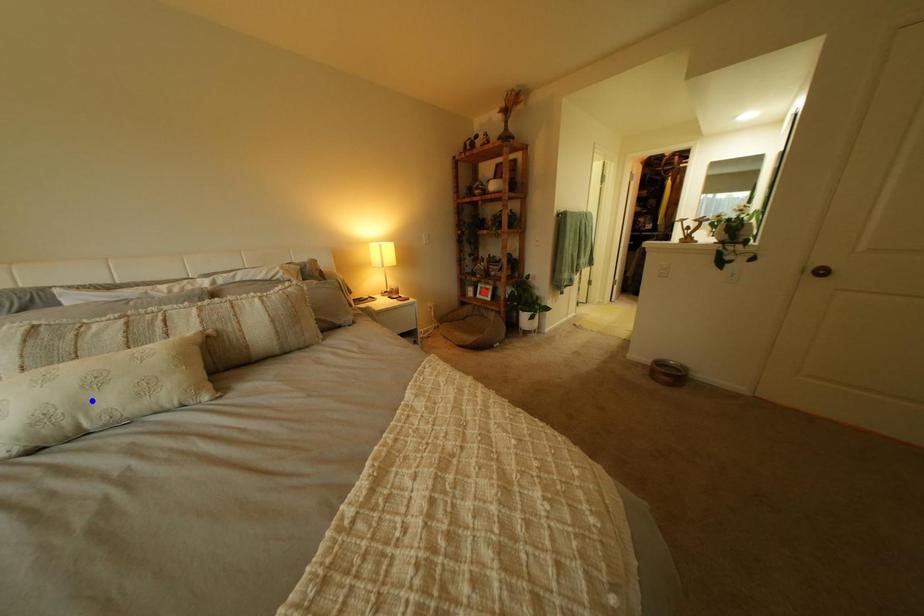
Question: In the image, two points are highlighted. Which point is nearer to the camera? Reply with the corresponding letter.

Choices:
 (A) blue point
 (B) red point

Answer: (A)